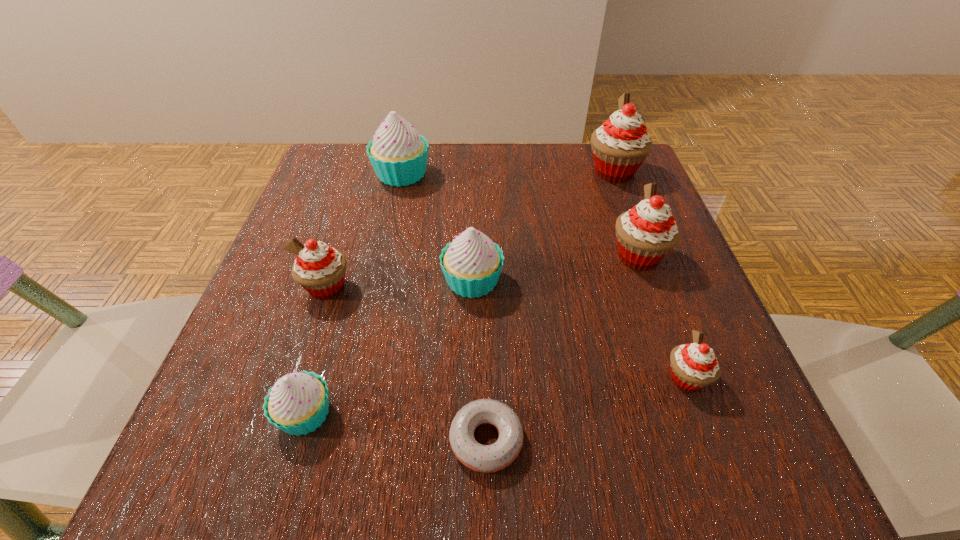
Select which cupcake is the second closest to the nearest pink cupcake. Please provide its 2D coordinates. Your answer should be formatted as a tuple, i.e. [(x, y)], where the tuple contains the x and y coordinates of a point satisfying the conditions above.

[(472, 263)]

Identify which cupcake is located as the sixth nearest to the second biggest pink cupcake. Please provide its 2D coordinates. Your answer should be formatted as a tuple, i.e. [(x, y)], where the tuple contains the x and y coordinates of a point satisfying the conditions above.

[(298, 403)]

The image size is (960, 540). Find the location of `pink cupcake that stands as the second closest to the second biggest pink cupcake`. pink cupcake that stands as the second closest to the second biggest pink cupcake is located at coordinates (693, 366).

Choose which pink cupcake is the third nearest neighbor to the tallest cupcake. Please provide its 2D coordinates. Your answer should be formatted as a tuple, i.e. [(x, y)], where the tuple contains the x and y coordinates of a point satisfying the conditions above.

[(320, 269)]

Locate which white cupcake is the third closest to the nearest pink cupcake. Please provide its 2D coordinates. Your answer should be formatted as a tuple, i.e. [(x, y)], where the tuple contains the x and y coordinates of a point satisfying the conditions above.

[(398, 154)]

What are the coordinates of `white cupcake that is the second closest one to the biggest pink cupcake` in the screenshot? It's located at click(398, 154).

You are a GUI agent. You are given a task and a screenshot of the screen. Output one action in this format:
    pyautogui.click(x=<x>, y=<y>)
    Task: Click on the vacant point that satisfies the following two spatial constraints: 1. on the front side of the smallest pink cupcake; 2. on the right side of the biggest white cupcake
    
    Given the screenshot: What is the action you would take?
    pyautogui.click(x=356, y=379)